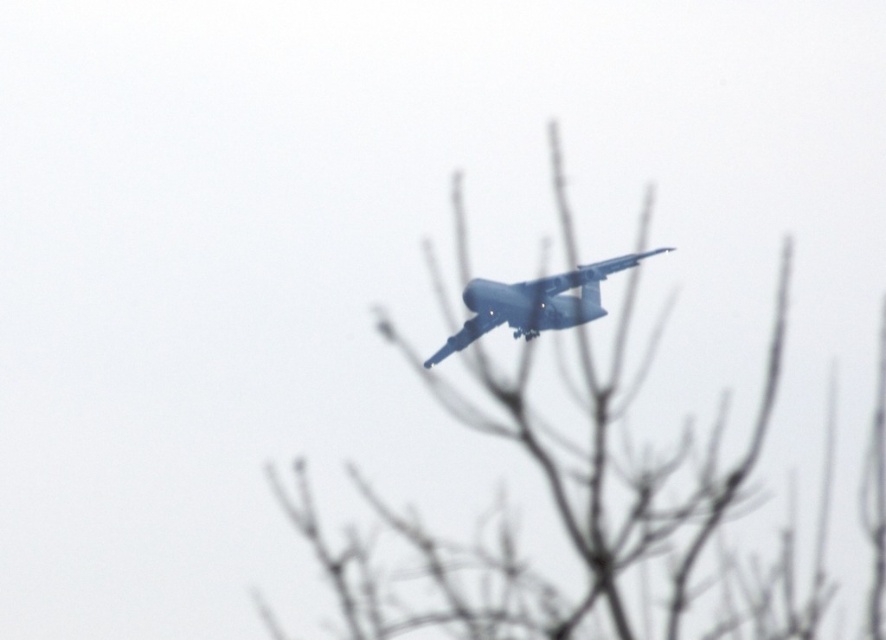
Question: Which object appears closest to the camera in this image?

Choices:
 (A) matte blue airplane at center
 (B) bare branches at center

Answer: (B)

Question: Which object appears farthest from the camera in this image?

Choices:
 (A) matte blue airplane at center
 (B) bare branches at center

Answer: (A)

Question: Is the position of bare branches at center more distant than that of matte blue airplane at center?

Choices:
 (A) no
 (B) yes

Answer: (A)

Question: Which point is closer to the camera?

Choices:
 (A) bare branches at center
 (B) matte blue airplane at center

Answer: (A)

Question: Where is bare branches at center located in relation to matte blue airplane at center in the image?

Choices:
 (A) left
 (B) right

Answer: (A)

Question: From the image, what is the correct spatial relationship of bare branches at center in relation to matte blue airplane at center?

Choices:
 (A) above
 (B) below

Answer: (B)